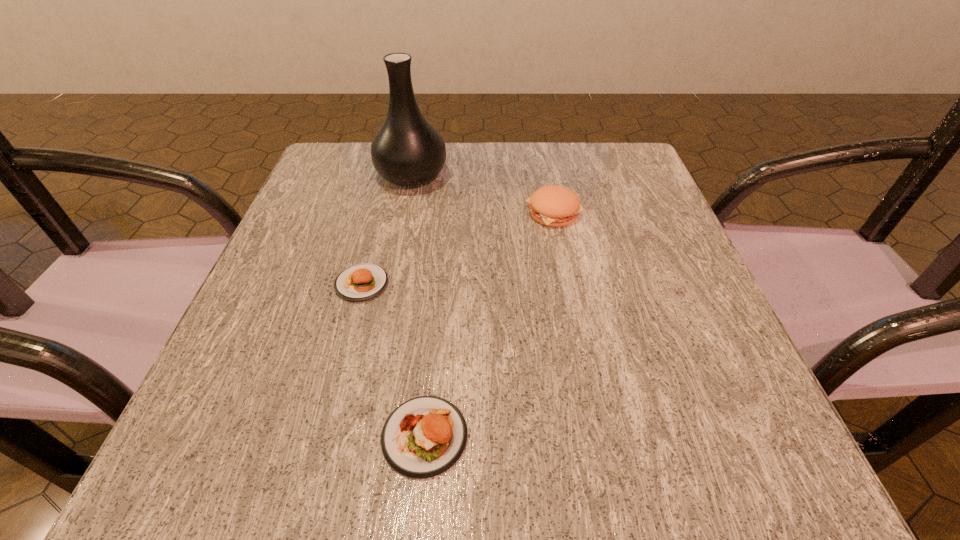
This screenshot has height=540, width=960. In the image, there is a desktop. Find the location of `vacant space at the left edge`. vacant space at the left edge is located at coordinates (298, 296).

Image resolution: width=960 pixels, height=540 pixels. Find the location of `free spot at the right edge of the desktop`. free spot at the right edge of the desktop is located at coordinates click(x=614, y=291).

This screenshot has width=960, height=540. In the image, there is a desktop. Find the location of `vacant space at the far left corner`. vacant space at the far left corner is located at coordinates (365, 179).

In the image, there is a desktop. In order to click on vacant space at the near left corner in this screenshot , I will do `click(212, 480)`.

Find the location of a particular element. blank space at the far right corner of the desktop is located at coordinates (651, 183).

At what (x,y) coordinates should I click in order to perform the action: click on vacant space at the near right corner of the desktop. Please return your answer as a coordinate pair (x, y). Looking at the image, I should click on (752, 468).

Find the location of a particular element. vacant area that lies between the second tallest object and the second food from right to left is located at coordinates (489, 324).

Locate an element on the screen. This screenshot has width=960, height=540. vacant space that is in between the nearest food and the shortest object is located at coordinates click(x=394, y=360).

Identify the location of free spot between the second food from right to left and the shortest object. (394, 360).

The height and width of the screenshot is (540, 960). I want to click on blank region between the vase and the third farthest object, so click(x=387, y=230).